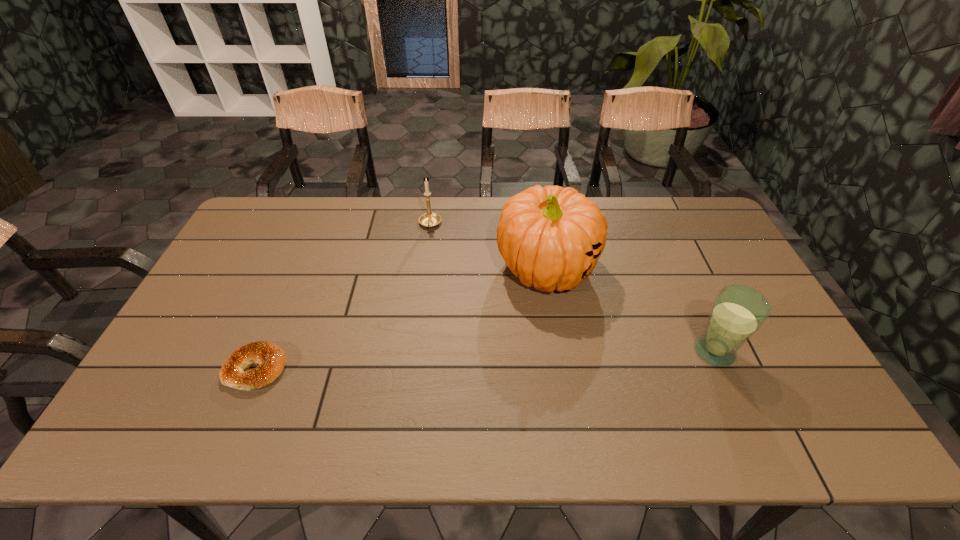
Find the location of a particular element. free point located on the surface of the pumpkin is located at coordinates (558, 392).

You are a GUI agent. You are given a task and a screenshot of the screen. Output one action in this format:
    pyautogui.click(x=<x>, y=<y>)
    Task: Click on the blank area located on the surface of the pumpkin
    The height and width of the screenshot is (540, 960).
    Given the screenshot: What is the action you would take?
    pyautogui.click(x=552, y=322)

I want to click on vacant point located on the handle side of the farthest object, so click(426, 275).

I want to click on vacant space located on the handle side of the farthest object, so click(428, 253).

This screenshot has height=540, width=960. What are the coordinates of `vacant space located 0.130m on the handle side of the farthest object` in the screenshot? It's located at (427, 260).

You are a GUI agent. You are given a task and a screenshot of the screen. Output one action in this format:
    pyautogui.click(x=<x>, y=<y>)
    Task: Click on the pumpkin that is positioned at the far edge
    This screenshot has width=960, height=540.
    Given the screenshot: What is the action you would take?
    pyautogui.click(x=551, y=238)

Locate an element on the screen. The image size is (960, 540). candle holder at the far edge is located at coordinates (429, 219).

This screenshot has height=540, width=960. Identify the location of object present at the near edge. (271, 359).

Locate an element on the screen. The image size is (960, 540). object at the right edge is located at coordinates (738, 312).

I want to click on vacant space at the far edge of the desktop, so click(x=312, y=204).